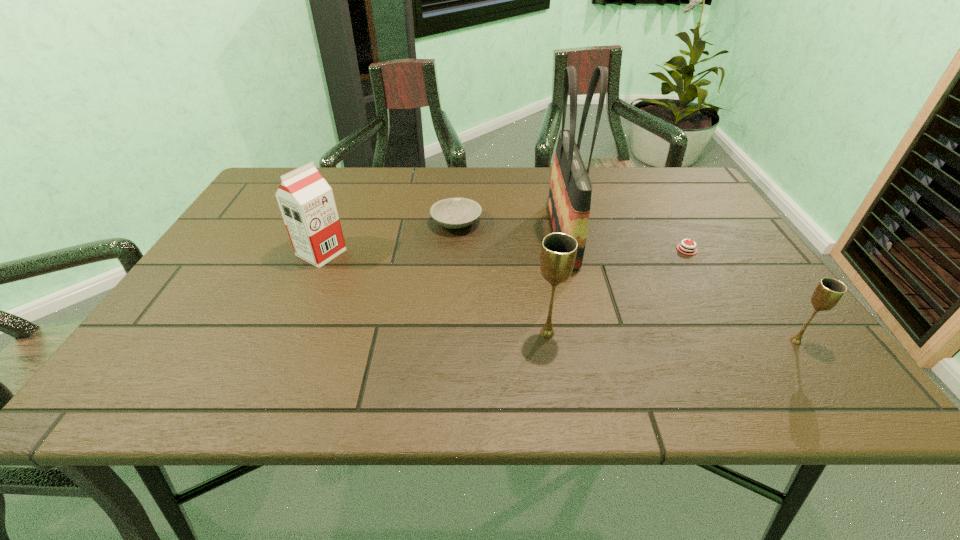
The image size is (960, 540). Find the location of `chalice located at the right edge`. chalice located at the right edge is located at coordinates (829, 291).

The image size is (960, 540). Identify the location of chocolate cake that is at the right edge. (686, 249).

Where is `object that is at the near right corner`? object that is at the near right corner is located at coordinates (829, 291).

You are a GUI agent. You are given a task and a screenshot of the screen. Output one action in this format:
    pyautogui.click(x=<x>, y=<y>)
    Task: Click on the free region at the far edge
    The width and height of the screenshot is (960, 540).
    Given the screenshot: What is the action you would take?
    pyautogui.click(x=606, y=168)

In the image, there is a desktop. Identify the location of free space at the near edge. (426, 326).

Locate an element on the screen. This screenshot has width=960, height=540. free space at the left edge of the desktop is located at coordinates (277, 234).

Find the location of `free location at the right edge`. free location at the right edge is located at coordinates (716, 312).

Find the location of a particular element. free spot at the far left corner of the desktop is located at coordinates (260, 193).

Identify the location of vacant region at the near left corner of the desktop. (202, 328).

Identify the location of empty space that is in between the left chalice and the second object from left to right. This screenshot has height=540, width=960. (502, 278).